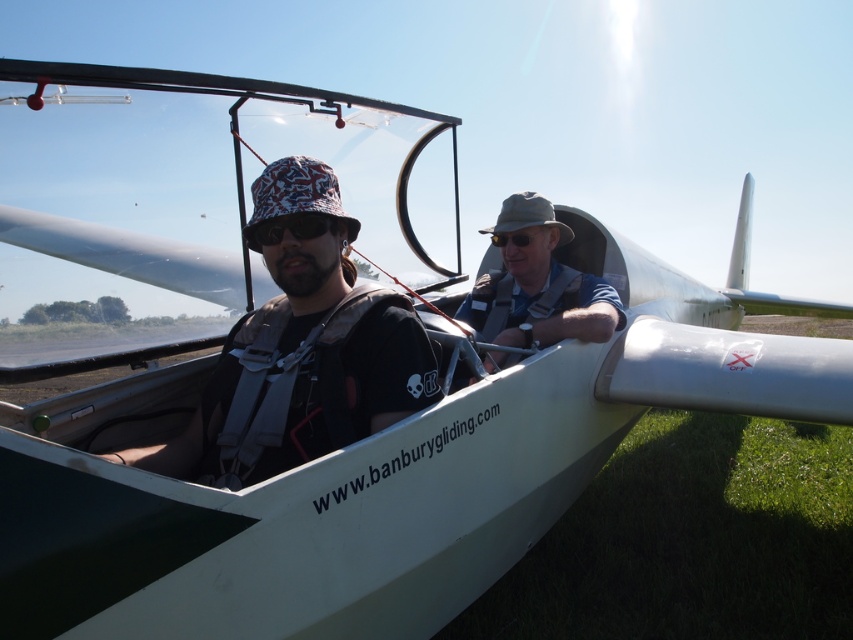
Question: Among these points, which one is nearest to the camera?

Choices:
 (A) (492, 241)
 (B) (341, 406)

Answer: (B)

Question: Which point is farther to the camera?

Choices:
 (A) (486, 307)
 (B) (329, 355)

Answer: (A)

Question: Can you confirm if light brown fabric hat at center is thinner than matte black goggles at center?

Choices:
 (A) no
 (B) yes

Answer: (A)

Question: Can you confirm if matte black helmet at center is positioned to the right of matte plastic goggles at center?

Choices:
 (A) yes
 (B) no

Answer: (A)

Question: Does matte black helmet at center come in front of matte black goggles at center?

Choices:
 (A) yes
 (B) no

Answer: (A)

Question: Which point appears farthest from the camera in this image?

Choices:
 (A) (294, 464)
 (B) (515, 236)
 (C) (288, 225)

Answer: (B)